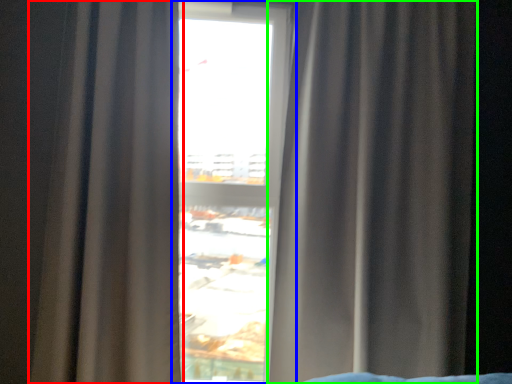
Question: Considering the real-world distances, which object is farthest from curtain (highlighted by a red box)? window (highlighted by a blue box) or curtain (highlighted by a green box)?

Choices:
 (A) window
 (B) curtain

Answer: (B)